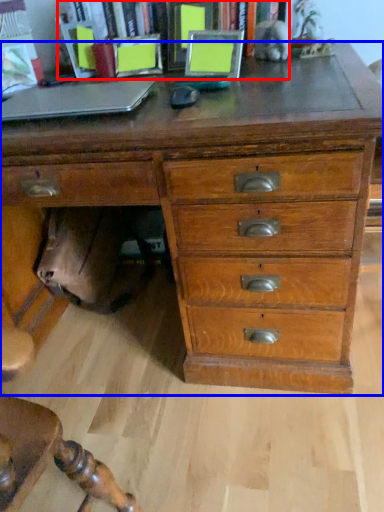
Question: Which point is further to the camera, bookcase (highlighted by a red box) or chest of drawers (highlighted by a blue box)?

Choices:
 (A) bookcase
 (B) chest of drawers

Answer: (A)